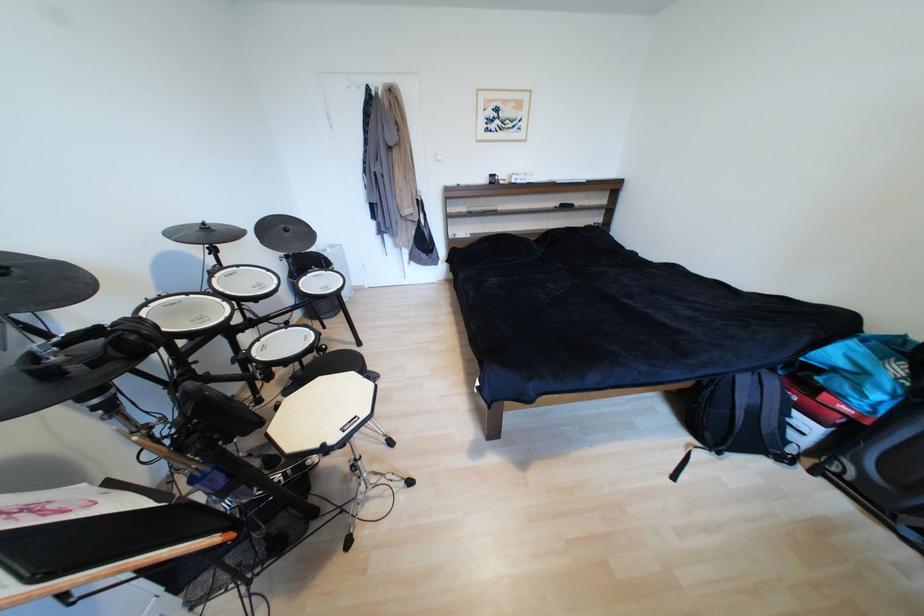
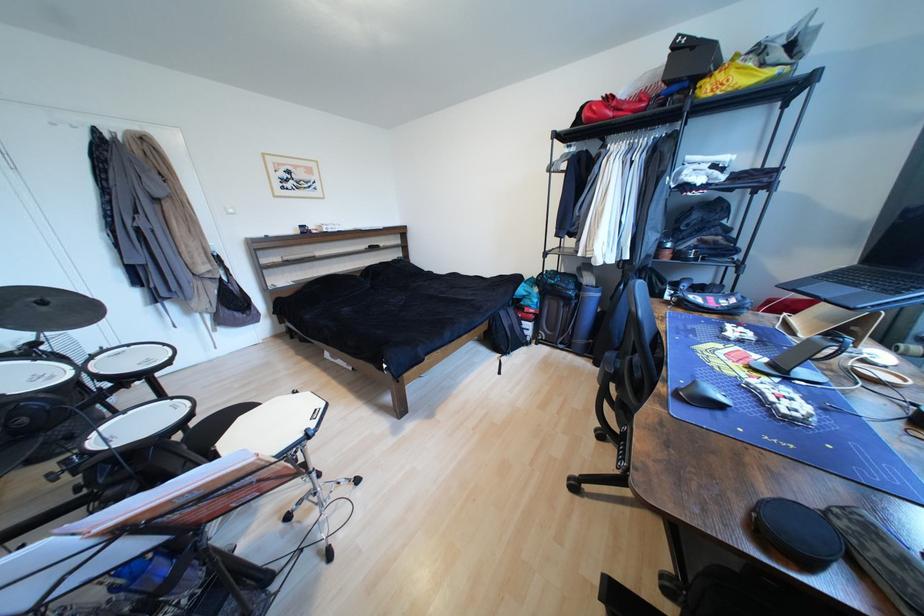
Question: Based on the continuous images, in which direction is the camera rotating? Reply with the corresponding letter.

Choices:
 (A) Left
 (B) Right
 (C) Up
 (D) Down

Answer: (B)